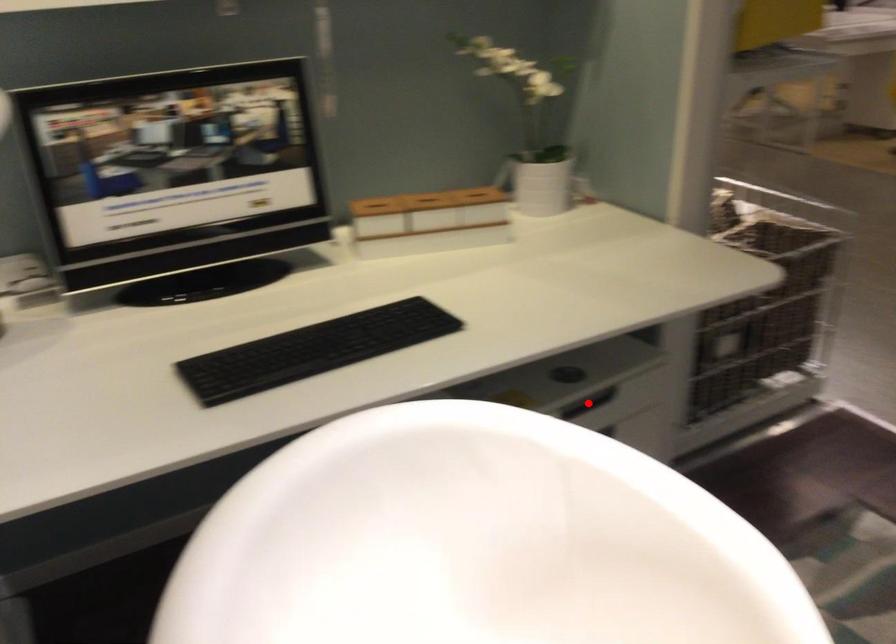
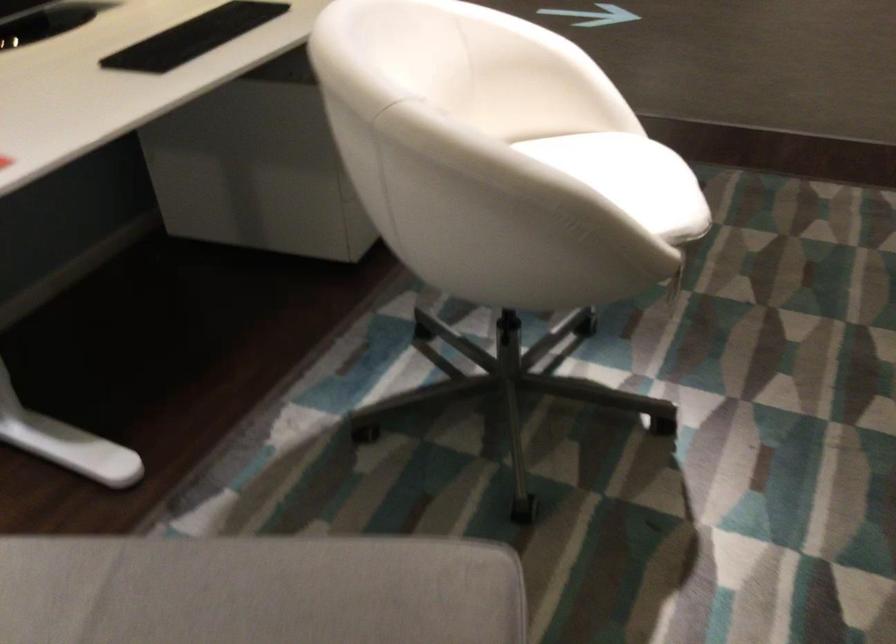
Question: I am providing you with two images of the same scene from different viewpoints. A red point is marked on the first image. Is the red point's position out of view in image 2?

Choices:
 (A) Yes
 (B) No

Answer: (A)